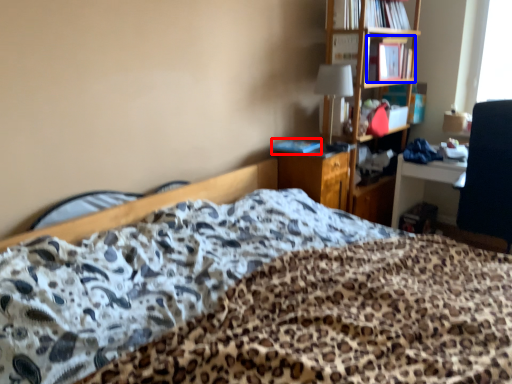
Question: Among these objects, which one is farthest to the camera, book (highlighted by a red box) or book (highlighted by a blue box)?

Choices:
 (A) book
 (B) book

Answer: (B)